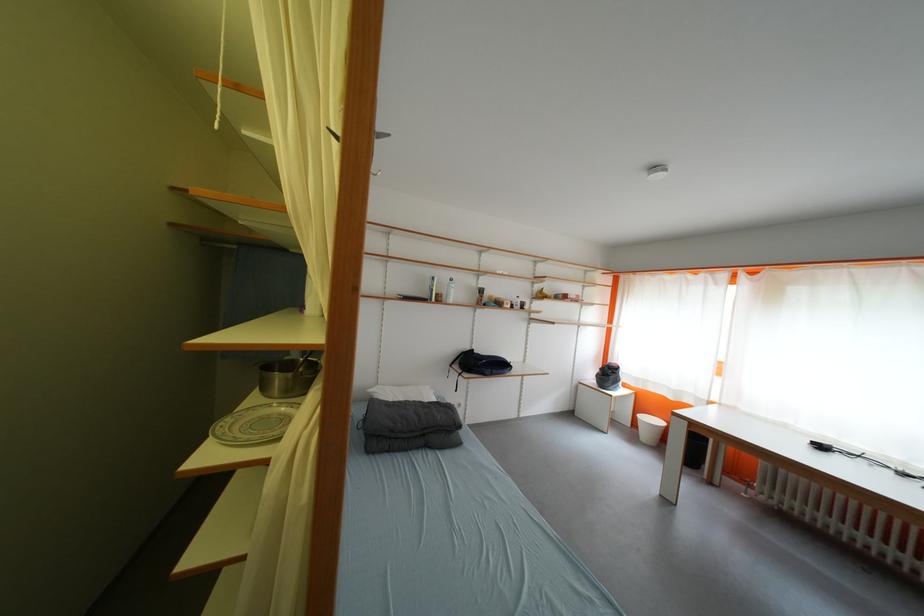
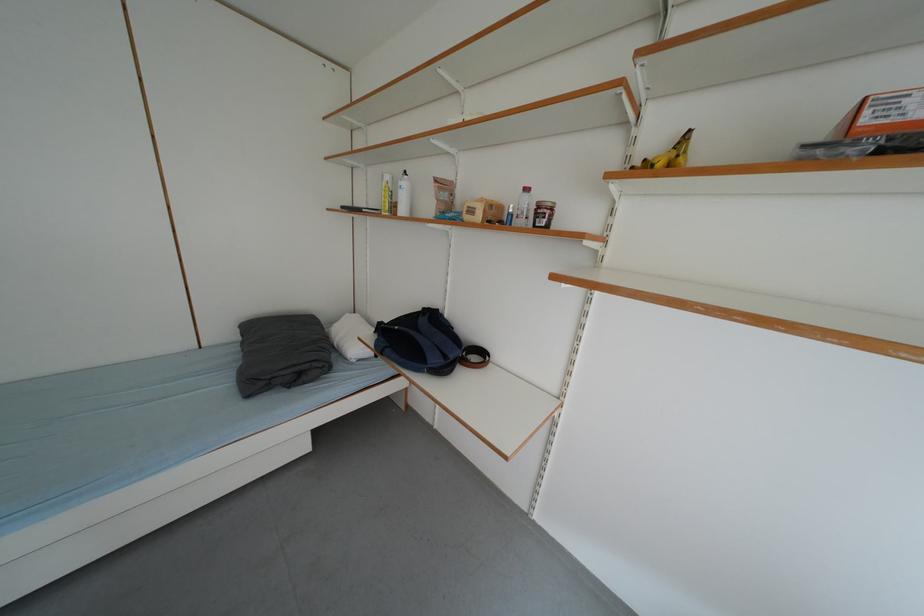
In the second image, find the point that corresponds to (x=503, y=374) in the first image.

(396, 354)